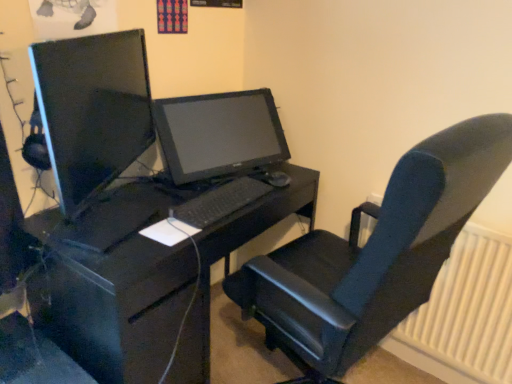
Describe the element at coordinates (373, 255) in the screenshot. I see `velvet-like black chair at center` at that location.

In order to click on black plastic mouse at center in this screenshot , I will do `click(277, 179)`.

Locate an element on the screen. The height and width of the screenshot is (384, 512). white plastic radiator at right is located at coordinates (464, 314).

This screenshot has width=512, height=384. Identify the location of black matte desk at center. (119, 294).

Is white plastic radiator at right positioned with its back to velvet-like black chair at center?

white plastic radiator at right does not have its back to velvet-like black chair at center.

Does point (446, 292) come in front of point (374, 243)?

No, (446, 292) is further to viewer.

From a real-world perspective, does white plastic radiator at right stand above velvet-like black chair at center?

Actually, white plastic radiator at right is physically below velvet-like black chair at center in the real world.

Would you say velvet-like black chair at center is a long distance from black matte desk at center?

No, there isn't a large distance between velvet-like black chair at center and black matte desk at center.

Is velvet-like black chair at center shorter than black matte desk at center?

Incorrect, the height of velvet-like black chair at center does not fall short of that of black matte desk at center.

Considering the points (353, 297) and (120, 294), which point is behind, point (353, 297) or point (120, 294)?

Positioned behind is point (120, 294).

Would you say velvet-like black chair at center contains black matte desk at center?

No, velvet-like black chair at center does not contain black matte desk at center.

Is velvet-like black chair at center to the left of black matte keyboard at center from the viewer's perspective?

No.

From the image's perspective, who appears lower, velvet-like black chair at center or black matte keyboard at center?

velvet-like black chair at center, from the image's perspective.

Is velvet-like black chair at center positioned before black matte keyboard at center?

Yes.

Considering the relative sizes of velvet-like black chair at center and black matte keyboard at center in the image provided, is velvet-like black chair at center wider than black matte keyboard at center?

Yes, velvet-like black chair at center is wider than black matte keyboard at center.

This screenshot has height=384, width=512. In order to click on radiator to the right of black matte keyboard at center in this screenshot , I will do `click(464, 314)`.

Which object is wider, white plastic radiator at right or black matte keyboard at center?

Wider between the two is black matte keyboard at center.

Is black matte keyboard at center completely or partially inside white plastic radiator at right?

Definitely not — black matte keyboard at center is not inside white plastic radiator at right.

Which point is more distant from viewer, (414,311) or (255,186)?

Positioned behind is point (414,311).

Can you confirm if black matte desk at center is taller than black plastic mouse at center?

Yes, black matte desk at center is taller than black plastic mouse at center.

Is black matte desk at center next to black plastic mouse at center?

No, black matte desk at center is not next to black plastic mouse at center.

Between black matte desk at center and black plastic mouse at center, which one appears on the left side from the viewer's perspective?

black matte desk at center is more to the left.

What's the angular difference between black matte desk at center and black plastic mouse at center's facing directions?

The facing directions of black matte desk at center and black plastic mouse at center are 2.77 degrees apart.

Is white plastic radiator at right aimed at black matte desk at center?

No, white plastic radiator at right is not aimed at black matte desk at center.

Where is `desk in front of the white plastic radiator at right`? Image resolution: width=512 pixels, height=384 pixels. desk in front of the white plastic radiator at right is located at coordinates (119, 294).

How many degrees apart are the facing directions of white plastic radiator at right and black matte desk at center?

The angular difference between white plastic radiator at right and black matte desk at center is 92.6 degrees.

Is point (450, 366) positioned in front of point (139, 378)?

No, it is not.

Between matte black monitor at left and black matte desk at center, which one is positioned behind?

black matte desk at center is further from the camera.

Is matte black monitor at left surrounding black matte desk at center?

No, matte black monitor at left does not contain black matte desk at center.

From their relative heights in the image, would you say matte black monitor at left is taller or shorter than black matte desk at center?

matte black monitor at left is shorter than black matte desk at center.

Identify the location of desk below the matte black monitor at left (from the image's perspective). (119, 294).

I want to click on chair that appears in front of the white plastic radiator at right, so click(373, 255).

Locate an element on the screen. The image size is (512, 384). desk that appears below the velvet-like black chair at center (from the image's perspective) is located at coordinates (119, 294).

Considering their positions, is black matte keyboard at center positioned further to black matte desk at center than velvet-like black chair at center?

Among the two, velvet-like black chair at center is located further to black matte desk at center.

From the image, which object appears to be farther from black matte desk at center, black matte keyboard at center or matte black monitor at left?

matte black monitor at left is positioned further to the anchor black matte desk at center.

Looking at the image, which one is located further to velvet-like black chair at center, white plastic radiator at right or matte black monitor at left?

matte black monitor at left is further to velvet-like black chair at center.

Estimate the real-world distances between objects in this image. Which object is further from black matte keyboard at center, black plastic mouse at center or black matte desk at center?

black matte desk at center is positioned further to the anchor black matte keyboard at center.

Based on their spatial positions, is matte black monitor at left or black matte desk at center closer to black plastic mouse at center?

Among the two, black matte desk at center is located nearer to black plastic mouse at center.

Which object lies nearer to the anchor point black matte keyboard at center, velvet-like black chair at center or black matte desk at center?

The object closer to black matte keyboard at center is black matte desk at center.

Estimate the real-world distances between objects in this image. Which object is closer to white plastic radiator at right, velvet-like black chair at center or black matte keyboard at center?

Among the two, velvet-like black chair at center is located nearer to white plastic radiator at right.

Which object lies further to the anchor point black matte desk at center, velvet-like black chair at center or matte black monitor at left?

velvet-like black chair at center is positioned further to the anchor black matte desk at center.

Locate an element on the screen. This screenshot has width=512, height=384. desk between velvet-like black chair at center and black plastic mouse at center in the front-back direction is located at coordinates (119, 294).

Locate an element on the screen. This screenshot has height=384, width=512. computer keyboard between matte black monitor at left and velvet-like black chair at center is located at coordinates (219, 202).

Locate an element on the screen. Image resolution: width=512 pixels, height=384 pixels. computer keyboard between black matte desk at center and white plastic radiator at right in the horizontal direction is located at coordinates (219, 202).

Identify the location of radiator between velvet-like black chair at center and black plastic mouse at center from front to back. The image size is (512, 384). (464, 314).